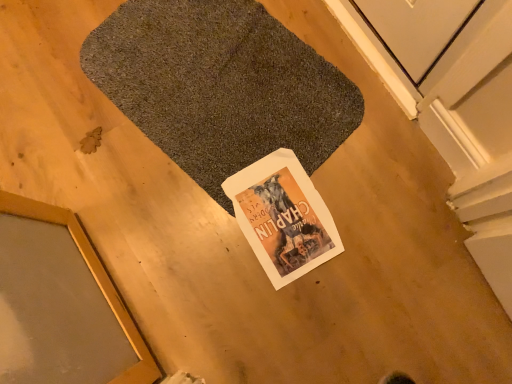
The width and height of the screenshot is (512, 384). I want to click on vacant point above white paper magazine at center (from a real-world perspective), so click(284, 213).